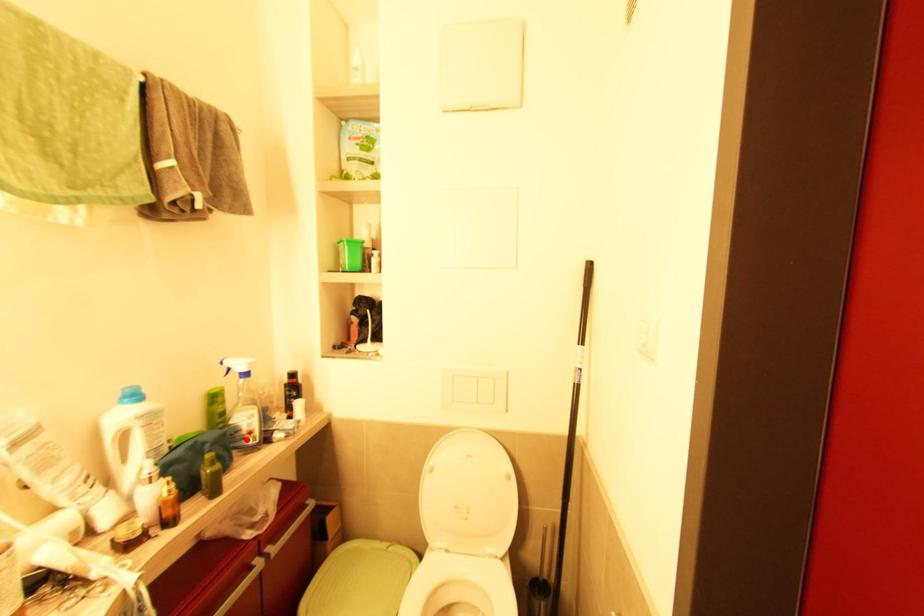
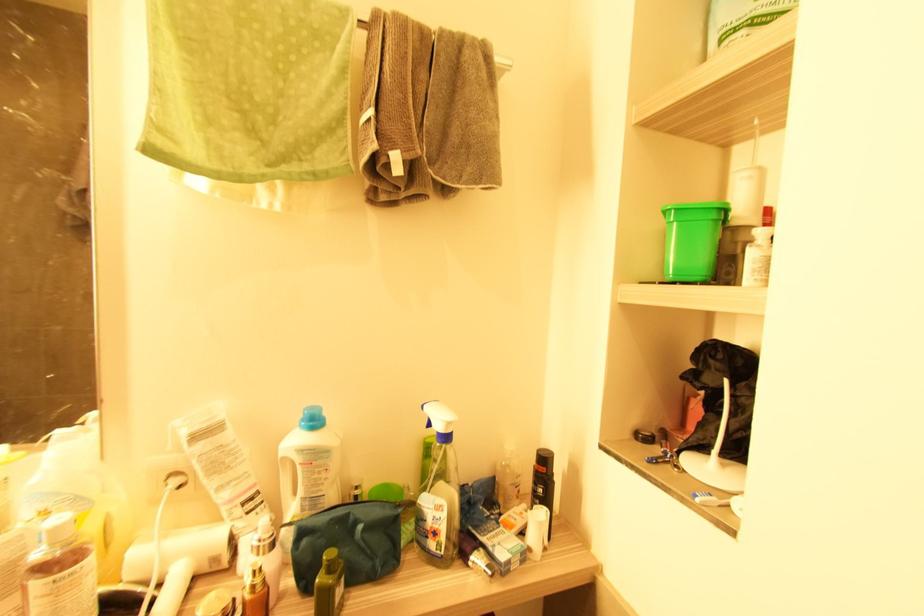
Find the pixel in the second image that matches the highlighted location in the first image.

(429, 539)